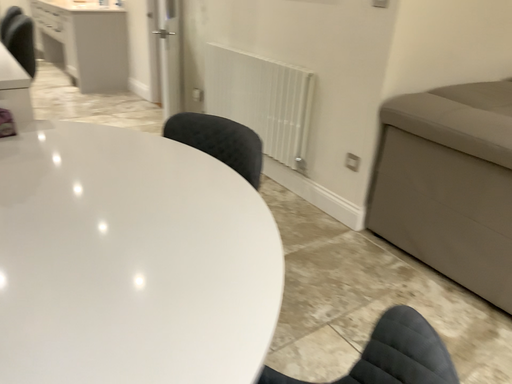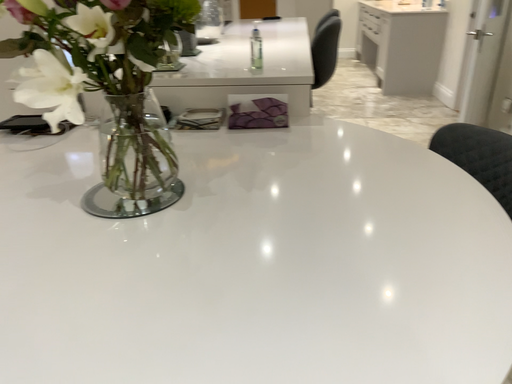
Question: Which way did the camera rotate in the video?

Choices:
 (A) rotated left
 (B) rotated right

Answer: (A)